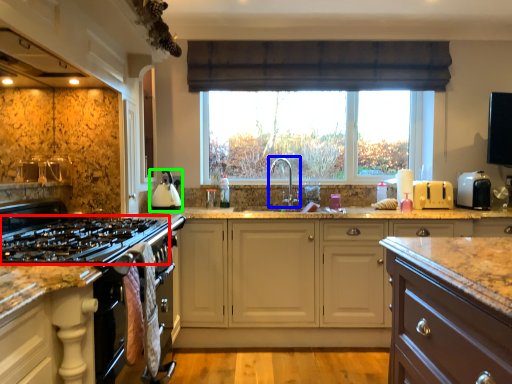
Question: Which is farther away from gas stove (highlighted by a red box)? tap (highlighted by a blue box) or kitchen appliance (highlighted by a green box)?

Choices:
 (A) tap
 (B) kitchen appliance

Answer: (A)